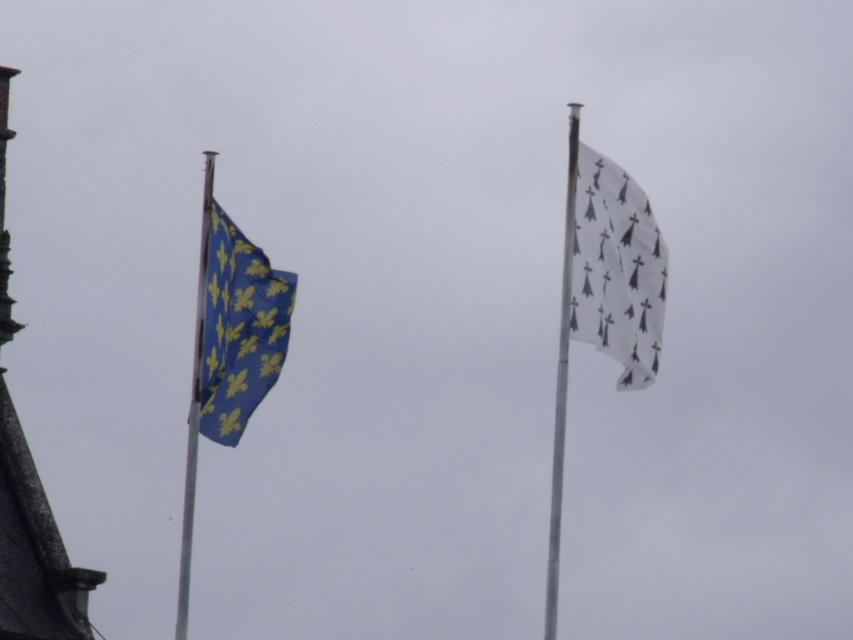
Describe the element at coordinates (33, 548) in the screenshot. This screenshot has height=640, width=853. I see `smooth stone tower at left` at that location.

Can you confirm if smooth stone tower at left is positioned above metallic silver flag pole at left?

Indeed, smooth stone tower at left is positioned over metallic silver flag pole at left.

This screenshot has width=853, height=640. Find the location of `smooth stone tower at left`. smooth stone tower at left is located at coordinates (33, 548).

This screenshot has width=853, height=640. I want to click on smooth stone tower at left, so click(33, 548).

Which of these two, blue fabric flag at left or rusty metal flag pole at right, stands shorter?

Standing shorter between the two is blue fabric flag at left.

Is blue fabric flag at left positioned before rusty metal flag pole at right?

Yes.

Where is `blue fabric flag at left`? The image size is (853, 640). blue fabric flag at left is located at coordinates (238, 330).

Which is above, rusty metal flag pole at right or metallic silver flag pole at left?

Positioned higher is metallic silver flag pole at left.

Who is taller, rusty metal flag pole at right or metallic silver flag pole at left?

With more height is rusty metal flag pole at right.

Who is more distant from viewer, (561,419) or (177,609)?

Point (177,609)

The image size is (853, 640). I want to click on rusty metal flag pole at right, so click(x=561, y=381).